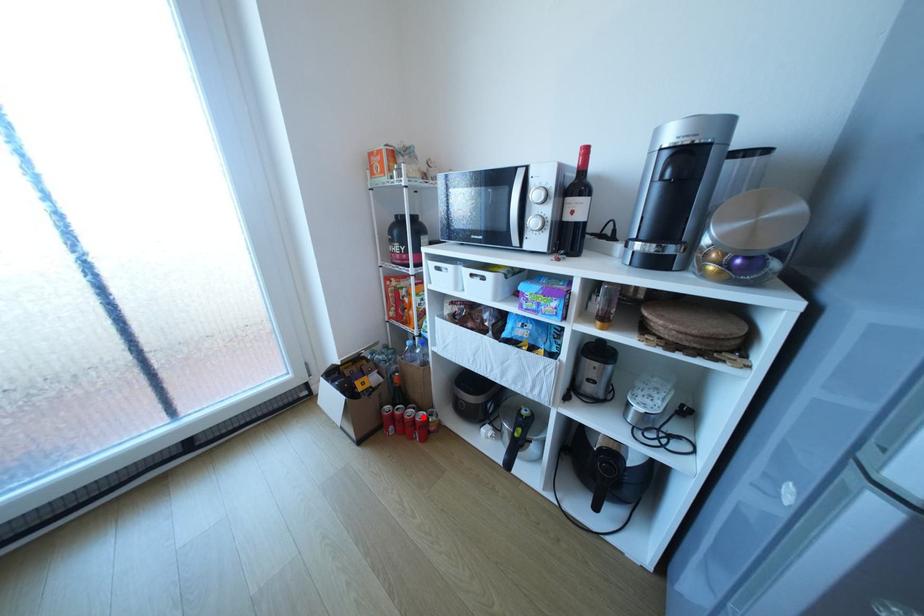
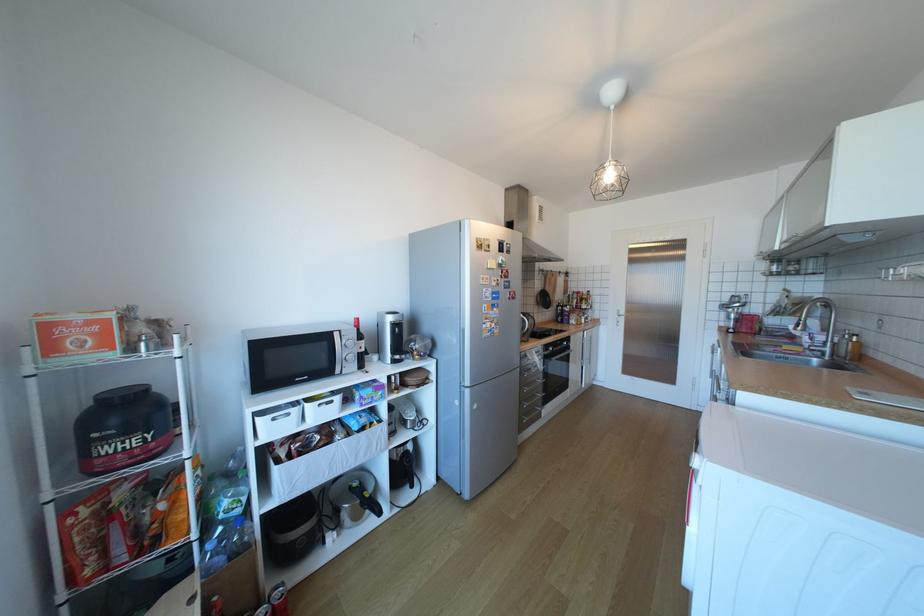
Find the pixel in the second image that matches the highlighted location in the first image.

(283, 607)